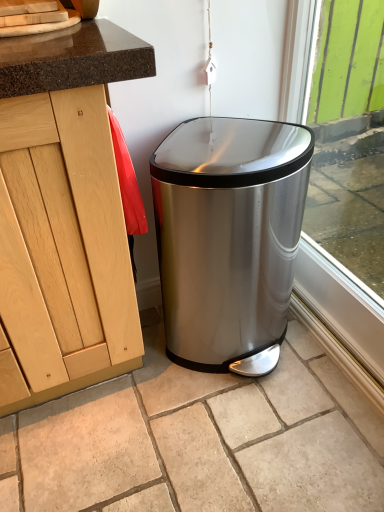
What do you see at coordinates (229, 238) in the screenshot?
I see `stainless steel trash can at center` at bounding box center [229, 238].

Consider the image. What is the approximate width of stainless steel trash can at center?

stainless steel trash can at center is 17.55 inches wide.

Find the location of `stainless steel trash can at center`. stainless steel trash can at center is located at coordinates (229, 238).

The width and height of the screenshot is (384, 512). Describe the element at coordinates (341, 316) in the screenshot. I see `green painted wood at right` at that location.

You are a GUI agent. You are given a task and a screenshot of the screen. Output one action in this format:
    pyautogui.click(x=<x>, y=<y>)
    Task: Click on the green painted wood at right
    The width and height of the screenshot is (384, 512).
    Given the screenshot: What is the action you would take?
    tap(341, 316)

I want to click on stainless steel trash can at center, so click(229, 238).

Visually, is stainless steel trash can at center positioned to the left or to the right of green painted wood at right?

Based on their positions, stainless steel trash can at center is located to the left of green painted wood at right.

Between stainless steel trash can at center and green painted wood at right, which one is positioned in front?

Positioned in front is green painted wood at right.

Is point (227, 362) behind point (374, 382)?

Yes, point (227, 362) is farther from viewer.

From the image's perspective, is stainless steel trash can at center located above or below green painted wood at right?

From the image's perspective, stainless steel trash can at center appears below green painted wood at right.

From a real-world perspective, is stainless steel trash can at center on top of green painted wood at right?

No, from a real-world perspective, stainless steel trash can at center is not over green painted wood at right

Consider the image. In terms of width, does stainless steel trash can at center look wider or thinner when compared to green painted wood at right?

Considering their sizes, stainless steel trash can at center looks broader than green painted wood at right.

Considering the sizes of stainless steel trash can at center and green painted wood at right in the image, is stainless steel trash can at center taller or shorter than green painted wood at right?

In the image, stainless steel trash can at center appears to be shorter than green painted wood at right.

Who is smaller, stainless steel trash can at center or green painted wood at right?

green painted wood at right.

Is green painted wood at right surrounded by stainless steel trash can at center?

No, green painted wood at right is not inside stainless steel trash can at center.

Would you consider stainless steel trash can at center to be distant from green painted wood at right?

They are positioned close to each other.

Is stainless steel trash can at center oriented towards green painted wood at right?

No.

How many degrees apart are the facing directions of stainless steel trash can at center and green painted wood at right?

88.7 degrees.

How far apart are stainless steel trash can at center and green painted wood at right?

They are 12.98 inches apart.

Locate an element on the screen. window frame above the stainless steel trash can at center (from the image's perspective) is located at coordinates (341, 316).

Which is more to the right, green painted wood at right or stainless steel trash can at center?

Positioned to the right is green painted wood at right.

Is green painted wood at right in front of stainless steel trash can at center?

Yes.

Considering the positions of point (306, 246) and point (285, 245), is point (306, 246) closer or farther from the camera than point (285, 245)?

Point (306, 246) is positioned farther from the camera compared to point (285, 245).

From the image's perspective, is green painted wood at right on top of stainless steel trash can at center?

Indeed, from the image's perspective, green painted wood at right is shown above stainless steel trash can at center.

From a real-world perspective, is green painted wood at right positioned above or below stainless steel trash can at center?

green painted wood at right is situated higher than stainless steel trash can at center in the real world.

Can you confirm if green painted wood at right is wider than stainless steel trash can at center?

Incorrect, the width of green painted wood at right does not surpass that of stainless steel trash can at center.

Considering the sizes of green painted wood at right and stainless steel trash can at center in the image, is green painted wood at right taller or shorter than stainless steel trash can at center?

Clearly, green painted wood at right is taller compared to stainless steel trash can at center.

Considering the sizes of objects green painted wood at right and stainless steel trash can at center in the image provided, who is bigger, green painted wood at right or stainless steel trash can at center?

stainless steel trash can at center is bigger.

Is green painted wood at right spatially inside stainless steel trash can at center, or outside of it?

green painted wood at right is located beyond the bounds of stainless steel trash can at center.

Is green painted wood at right in contact with stainless steel trash can at center?

No, green painted wood at right is not with stainless steel trash can at center.

Is green painted wood at right facing towards stainless steel trash can at center?

Yes, green painted wood at right faces towards stainless steel trash can at center.

Where is `waste container below the green painted wood at right (from a real-world perspective)`? waste container below the green painted wood at right (from a real-world perspective) is located at coordinates [x=229, y=238].

Where is `window frame that appears above the stainless steel trash can at center (from a real-world perspective)`? The height and width of the screenshot is (512, 384). window frame that appears above the stainless steel trash can at center (from a real-world perspective) is located at coordinates (341, 316).

The height and width of the screenshot is (512, 384). Find the location of `window frame that appears on the right of stainless steel trash can at center`. window frame that appears on the right of stainless steel trash can at center is located at coordinates (341, 316).